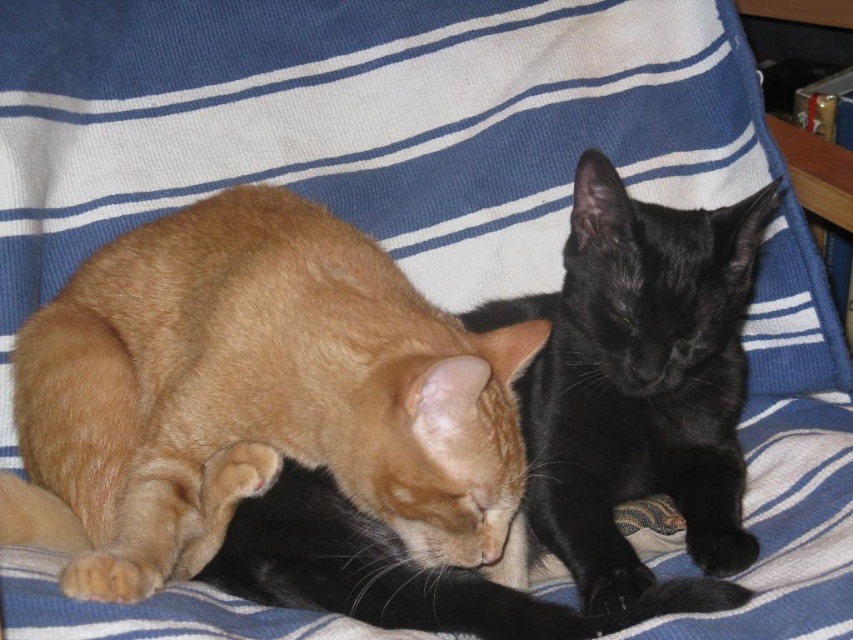
Question: Does orange fur cat at center appear under black silky cat at center?

Choices:
 (A) yes
 (B) no

Answer: (B)

Question: Is orange fur cat at center thinner than black silky cat at center?

Choices:
 (A) no
 (B) yes

Answer: (A)

Question: Among these objects, which one is farthest from the camera?

Choices:
 (A) orange fur cat at center
 (B) black silky cat at center

Answer: (B)

Question: Among these objects, which one is nearest to the camera?

Choices:
 (A) orange fur cat at center
 (B) black silky cat at center

Answer: (A)

Question: Is orange fur cat at center in front of black silky cat at center?

Choices:
 (A) no
 (B) yes

Answer: (B)